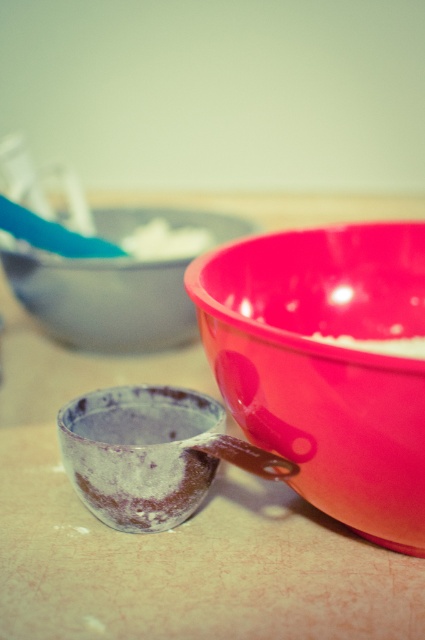
Question: From the image, what is the correct spatial relationship of matte plastic bowl at upper center in relation to white matte powder at center?

Choices:
 (A) below
 (B) above

Answer: (A)

Question: Can you confirm if glossy plastic bowl at right is wider than white matte bowl at center?

Choices:
 (A) no
 (B) yes

Answer: (B)

Question: Which point is farther to the camera?

Choices:
 (A) white matte bowl at center
 (B) white matte powder at center
 (C) glossy plastic bowl at right
 (D) blue plastic spoon at upper left

Answer: (B)

Question: Which point is closer to the camera taking this photo?

Choices:
 (A) (348, 524)
 (B) (224, 237)

Answer: (A)

Question: Is blue plastic spoon at upper left wider than white matte powder at center?

Choices:
 (A) no
 (B) yes

Answer: (A)

Question: Among these points, which one is nearest to the camera?

Choices:
 (A) (374, 346)
 (B) (124, 227)
 (C) (81, 256)
 (D) (167, 244)

Answer: (A)